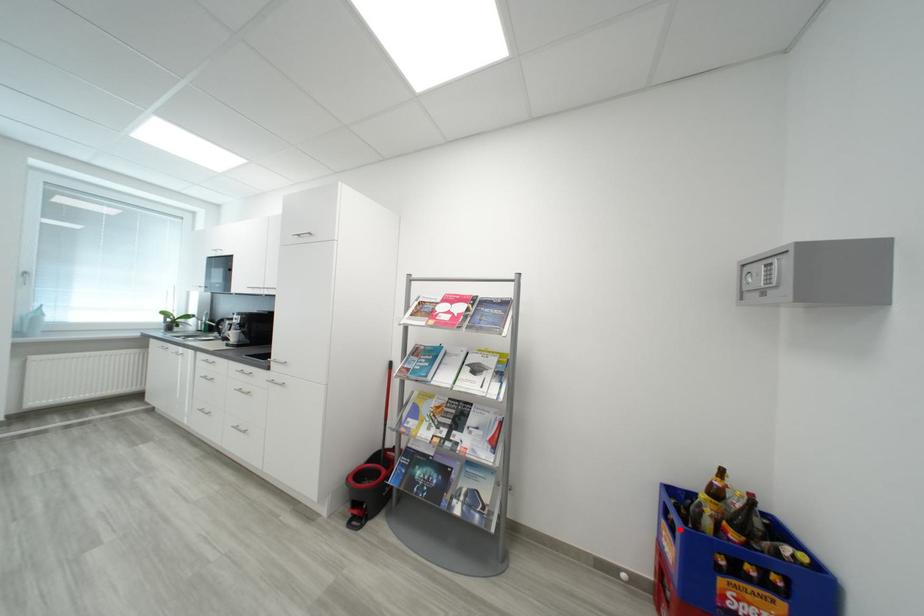
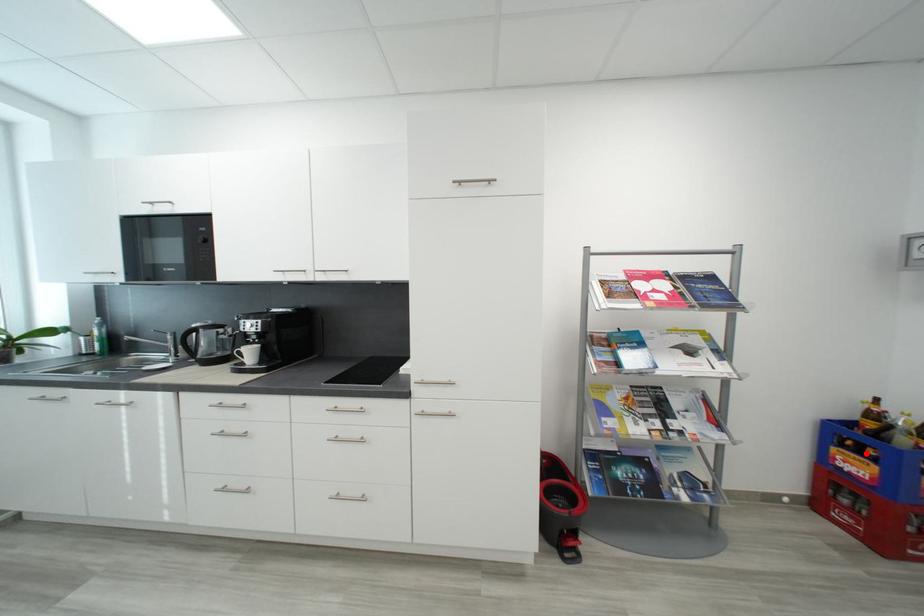
I am providing you with two images of the same scene from different viewpoints. A red point is marked on the first image and another point is marked on the second image. Are the points marked in image1 and image2 representing the same 3D position?

Yes